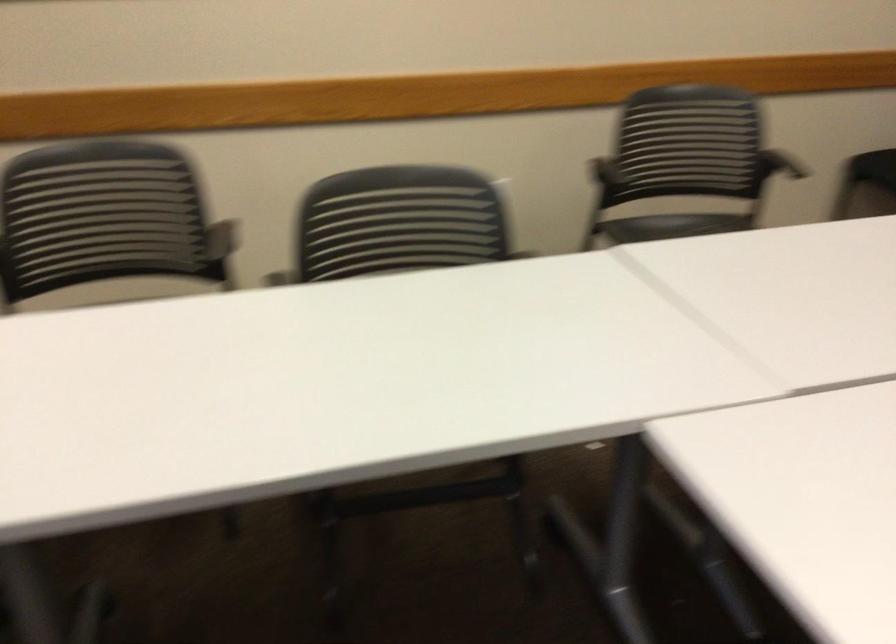
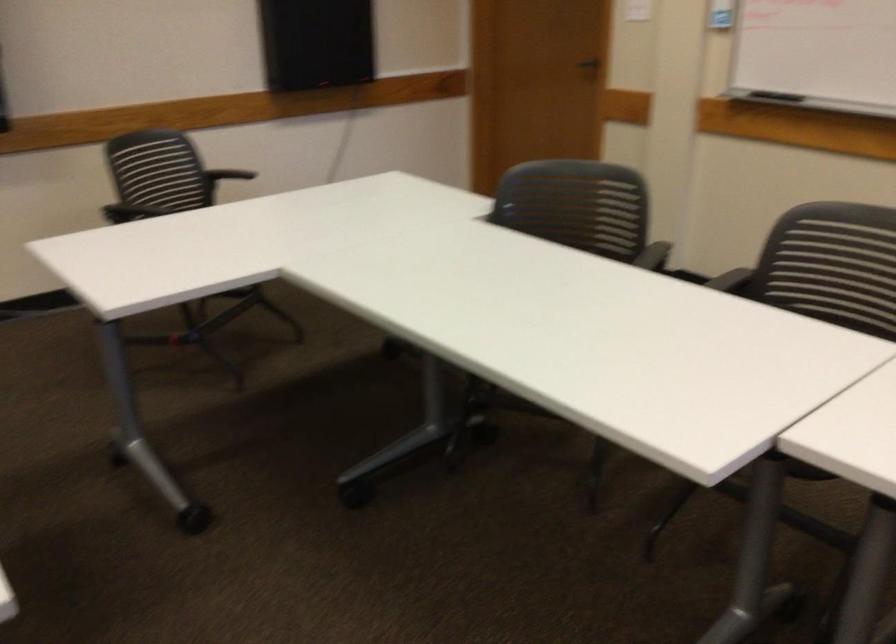
How did the camera likely rotate?

The rotation direction of the camera is right-down.